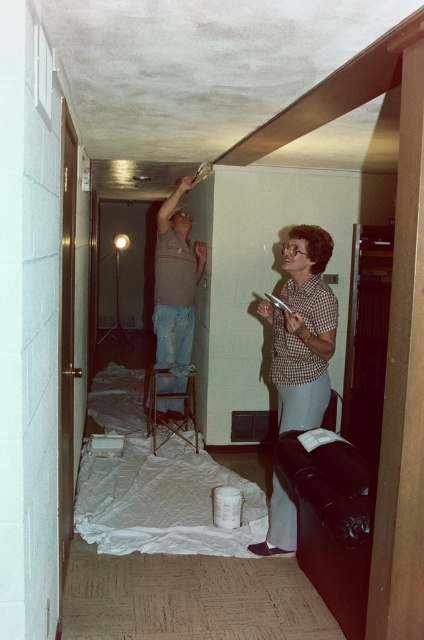
Which is above, checkered fabric blouse at center or wooden stool at center?

Positioned higher is checkered fabric blouse at center.

Is checkered fabric blouse at center above wooden stool at center?

Correct, checkered fabric blouse at center is located above wooden stool at center.

Identify the location of checkered fabric blouse at center. The image size is (424, 640). (303, 330).

Based on the photo, is checkered fabric blouse at center taller than matte brown shirt at upper center?

No.

Does checkered fabric blouse at center have a smaller size compared to matte brown shirt at upper center?

Correct, checkered fabric blouse at center occupies less space than matte brown shirt at upper center.

What are the coordinates of `checkered fabric blouse at center` in the screenshot? It's located at (303, 330).

Find the location of a particular element. The width and height of the screenshot is (424, 640). checkered fabric blouse at center is located at coordinates (303, 330).

Does matte brown shirt at upper center have a lesser height compared to wooden stool at center?

No, matte brown shirt at upper center is not shorter than wooden stool at center.

What do you see at coordinates (175, 282) in the screenshot? Image resolution: width=424 pixels, height=640 pixels. I see `matte brown shirt at upper center` at bounding box center [175, 282].

Locate an element on the screen. The height and width of the screenshot is (640, 424). matte brown shirt at upper center is located at coordinates (175, 282).